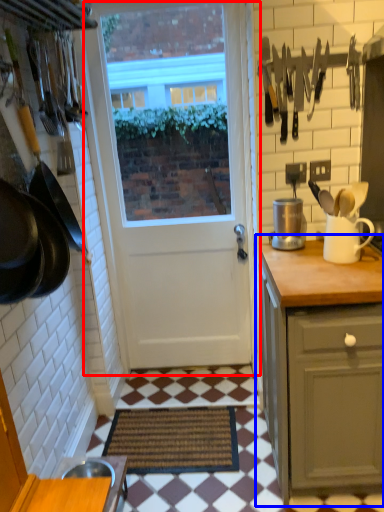
Question: Which object appears farthest to the camera in this image, door (highlighted by a red box) or cabinetry (highlighted by a blue box)?

Choices:
 (A) door
 (B) cabinetry

Answer: (A)